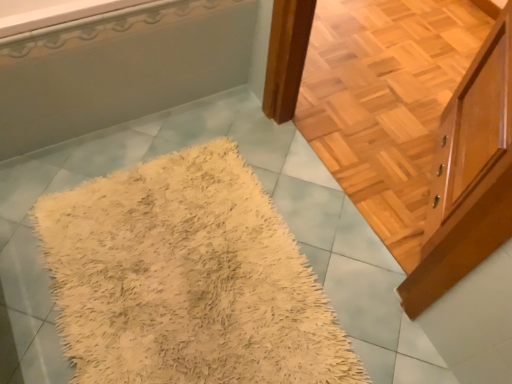
Question: Is light brown wood cabinet at upper right taller or shorter than beige shaggy rug at center?

Choices:
 (A) tall
 (B) short

Answer: (A)

Question: Is light brown wood cabinet at upper right bigger or smaller than beige shaggy rug at center?

Choices:
 (A) big
 (B) small

Answer: (A)

Question: Which of these objects is positioned closest to the light brown wood cabinet at upper right?

Choices:
 (A) beige shaggy rug at center
 (B) white glossy bathtub at upper left

Answer: (A)

Question: Estimate the real-world distances between objects in this image. Which object is farther from the white glossy bathtub at upper left?

Choices:
 (A) beige shaggy rug at center
 (B) light brown wood cabinet at upper right

Answer: (B)